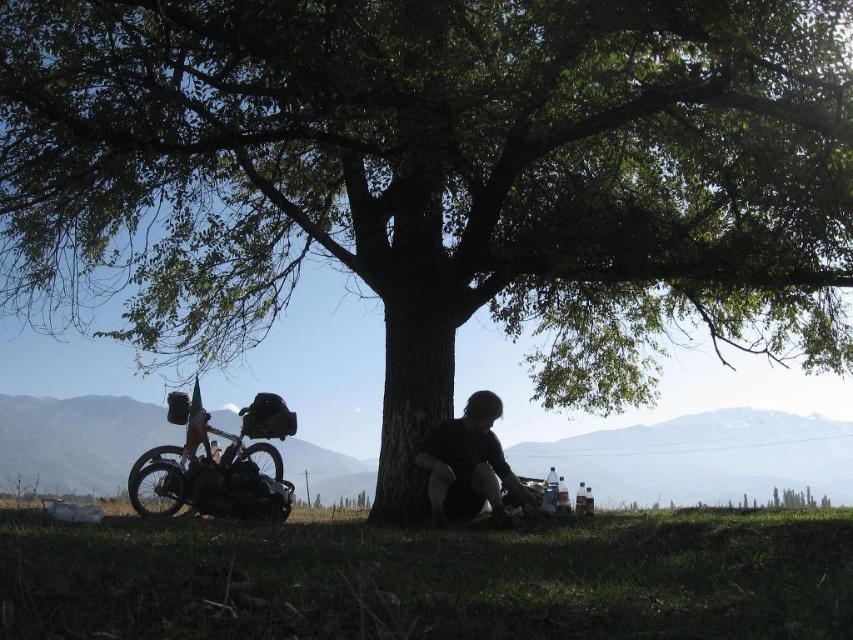
You are a photographer setting up a tripod to capture the scene under the large tree. You notice the silver metallic bicycle at left and the black matte shirt at lower center. Which object should you adjust your camera angle to avoid blocking the view of the other?

The silver metallic bicycle at left is taller than the black matte shirt at lower center, so you should adjust your camera angle to avoid the silver metallic bicycle at left blocking the view of the black matte shirt at lower center.